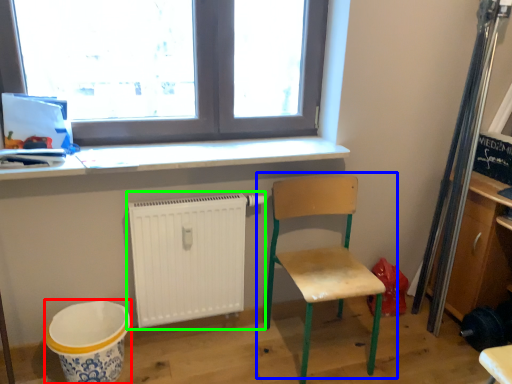
Question: Estimate the real-world distances between objects in this image. Which object is farther from mixing bowl (highlighted by a red box), chair (highlighted by a blue box) or radiator (highlighted by a green box)?

Choices:
 (A) chair
 (B) radiator

Answer: (A)